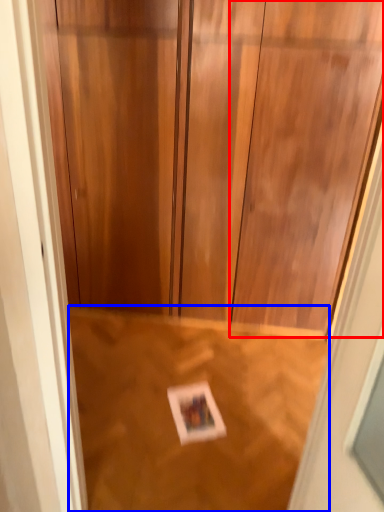
Question: Which object appears closest to the camera in this image, door (highlighted by a red box) or plywood (highlighted by a blue box)?

Choices:
 (A) door
 (B) plywood

Answer: (A)